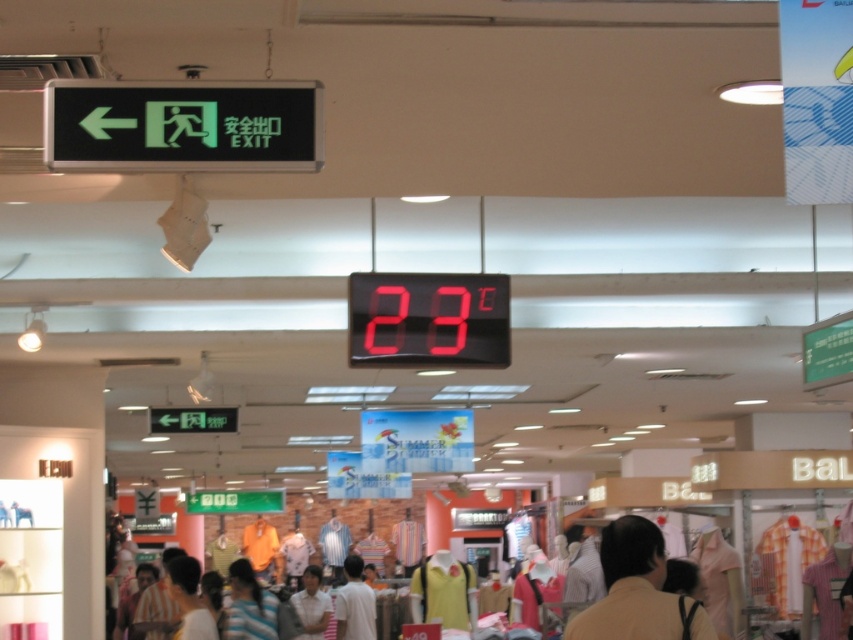
Can you confirm if brown fabric shirt at lower right is positioned below light brown shirt at center?

No, brown fabric shirt at lower right is not below light brown shirt at center.

Which is more to the left, brown fabric shirt at lower right or light brown shirt at center?

Positioned to the left is light brown shirt at center.

The image size is (853, 640). I want to click on brown fabric shirt at lower right, so click(630, 588).

Is light brown shirt at center smaller than white shirt at center?

No.

Is light brown shirt at center below white shirt at center?

Incorrect, light brown shirt at center is not positioned below white shirt at center.

This screenshot has width=853, height=640. What do you see at coordinates (354, 604) in the screenshot?
I see `light brown shirt at center` at bounding box center [354, 604].

Identify the location of light brown shirt at center. (354, 604).

Does brown fabric shirt at lower right have a lesser height compared to white shirt at center?

No, brown fabric shirt at lower right is not shorter than white shirt at center.

Can you confirm if brown fabric shirt at lower right is positioned to the left of white shirt at center?

In fact, brown fabric shirt at lower right is to the right of white shirt at center.

Locate an element on the screen. brown fabric shirt at lower right is located at coordinates (630, 588).